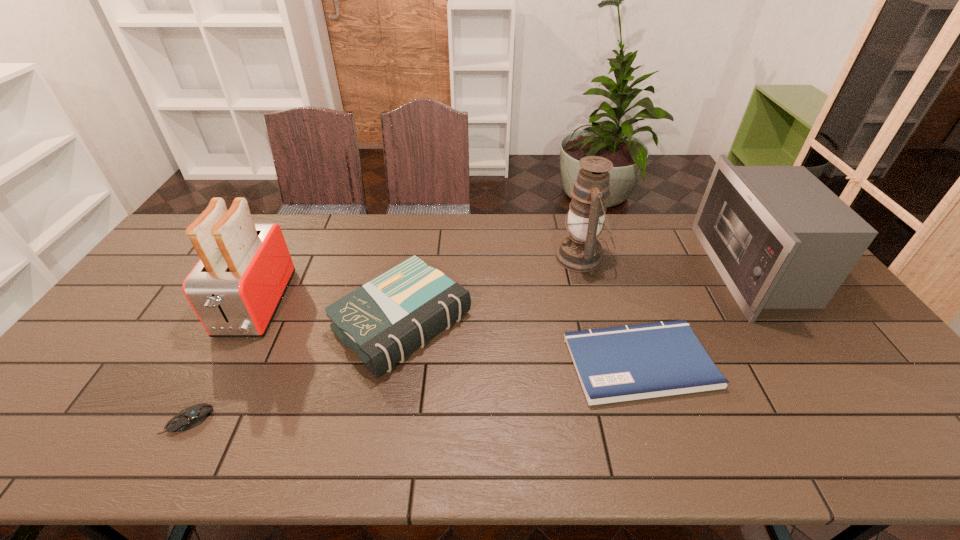
Where is `free spot between the computer mouse and the toaster`? This screenshot has height=540, width=960. free spot between the computer mouse and the toaster is located at coordinates (222, 363).

Identify the location of vacant space that's between the shorter paperback book and the microwave oven. (697, 316).

I want to click on empty space that is in between the toaster and the shorter paperback book, so click(x=447, y=334).

Locate an element on the screen. The width and height of the screenshot is (960, 540). empty location between the microwave oven and the right paperback book is located at coordinates (697, 316).

Where is `the second closest object to the computer mouse`? The image size is (960, 540). the second closest object to the computer mouse is located at coordinates (383, 321).

This screenshot has width=960, height=540. What are the coordinates of `object that can be found as the second closest to the computer mouse` in the screenshot? It's located at (383, 321).

You are a GUI agent. You are given a task and a screenshot of the screen. Output one action in this format:
    pyautogui.click(x=<x>, y=<y>)
    Task: Click on the free space that satisfies the following two spatial constraints: 1. on the front-facing side of the left paperback book; 2. on the right side of the toaster
    This screenshot has width=960, height=540.
    Given the screenshot: What is the action you would take?
    pyautogui.click(x=246, y=323)

You are a GUI agent. You are given a task and a screenshot of the screen. Output one action in this format:
    pyautogui.click(x=<x>, y=<y>)
    Task: Click on the vacant region that satisfies the following two spatial constraints: 1. on the front side of the left paperback book; 2. on the left side of the shorter paperback book
    Image resolution: width=960 pixels, height=540 pixels.
    Given the screenshot: What is the action you would take?
    coord(396,362)

Locate an element on the screen. free spot that satisfies the following two spatial constraints: 1. on the front-facing side of the right paperback book; 2. on the right side of the toaster is located at coordinates (225, 362).

You are a GUI agent. You are given a task and a screenshot of the screen. Output one action in this format:
    pyautogui.click(x=<x>, y=<y>)
    Task: Click on the free space that satisfies the following two spatial constraints: 1. on the front-facing side of the toaster; 2. on the right side of the right paperback book
    This screenshot has width=960, height=540.
    Given the screenshot: What is the action you would take?
    pyautogui.click(x=225, y=362)